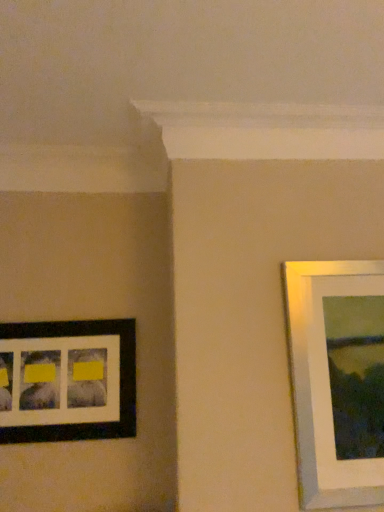
The image size is (384, 512). Identify the location of black matte picture frame at lower left. (67, 380).

What do you see at coordinates (67, 380) in the screenshot? The height and width of the screenshot is (512, 384). I see `black matte picture frame at lower left` at bounding box center [67, 380].

Where is `black matte picture frame at lower left`? black matte picture frame at lower left is located at coordinates (67, 380).